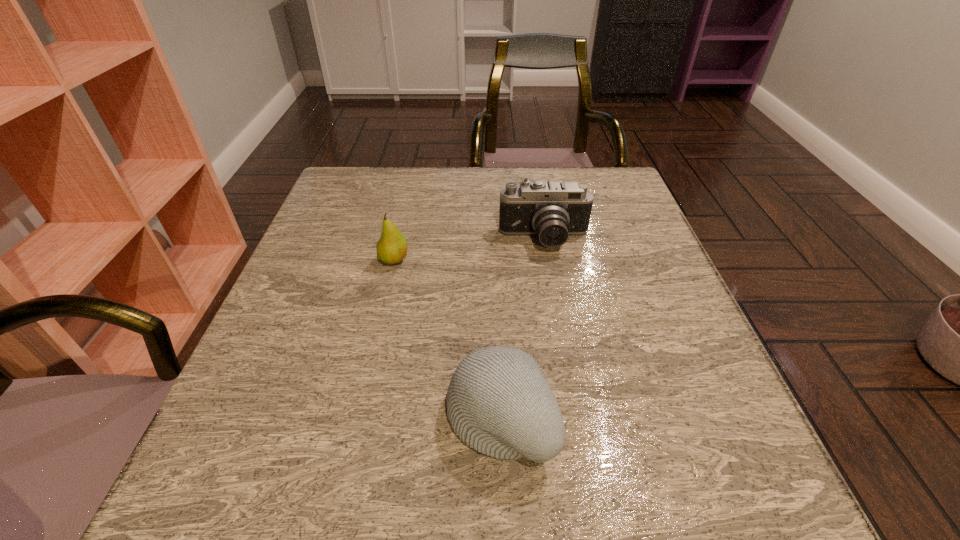
I want to click on vacant area at the left edge of the desktop, so click(352, 304).

The height and width of the screenshot is (540, 960). I want to click on vacant space at the right edge of the desktop, so click(724, 427).

In the image, there is a desktop. Where is `vacant space at the far left corner`? The image size is (960, 540). vacant space at the far left corner is located at coordinates (358, 189).

Where is `free location at the near left corner of the desktop`? The width and height of the screenshot is (960, 540). free location at the near left corner of the desktop is located at coordinates (252, 516).

In the image, there is a desktop. At what (x,y) coordinates should I click in order to perform the action: click on vacant space at the near right corner. Please return your answer as a coordinate pair (x, y). Image resolution: width=960 pixels, height=540 pixels. Looking at the image, I should click on (758, 502).

The width and height of the screenshot is (960, 540). I want to click on free point between the camera and the beanie, so click(x=522, y=328).

You are a GUI agent. You are given a task and a screenshot of the screen. Output one action in this format:
    pyautogui.click(x=<x>, y=<y>)
    Task: Click on the empty location between the pear and the camera
    
    Given the screenshot: What is the action you would take?
    pyautogui.click(x=469, y=250)

Find the location of a particular element. This screenshot has height=540, width=960. vacant space in between the beanie and the camera is located at coordinates (522, 328).

Locate an element on the screen. The height and width of the screenshot is (540, 960). empty location between the pear and the beanie is located at coordinates (446, 338).

Locate an element on the screen. free spot between the pear and the nearest object is located at coordinates (446, 338).